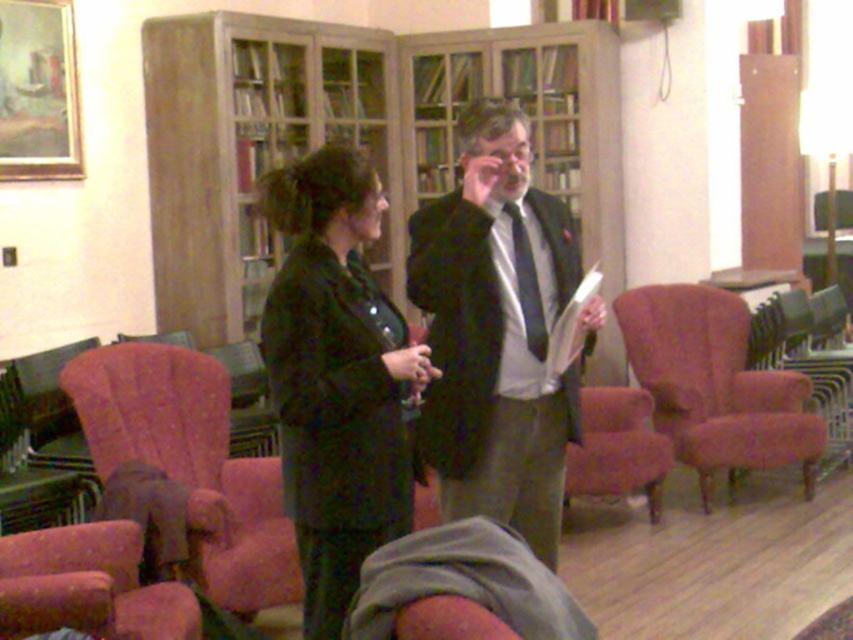
You are a visitor in this library and want to sit down on the velvet pink armchair at lower left. Is the matte black jacket at center blocking your path to the chair?

The matte black jacket at center is above the velvet pink armchair at lower left, so it is not blocking the path to the chair since it is positioned above it.

You are standing in the library and want to sit down on the velvet pink armchair at right. To reach it, you must pass by the matte black suit at center. Is the path clear between them?

The matte black suit at center is closer to the viewer than the velvet pink armchair at right, so the path between them is clear as the suit is in front and the chair is behind.